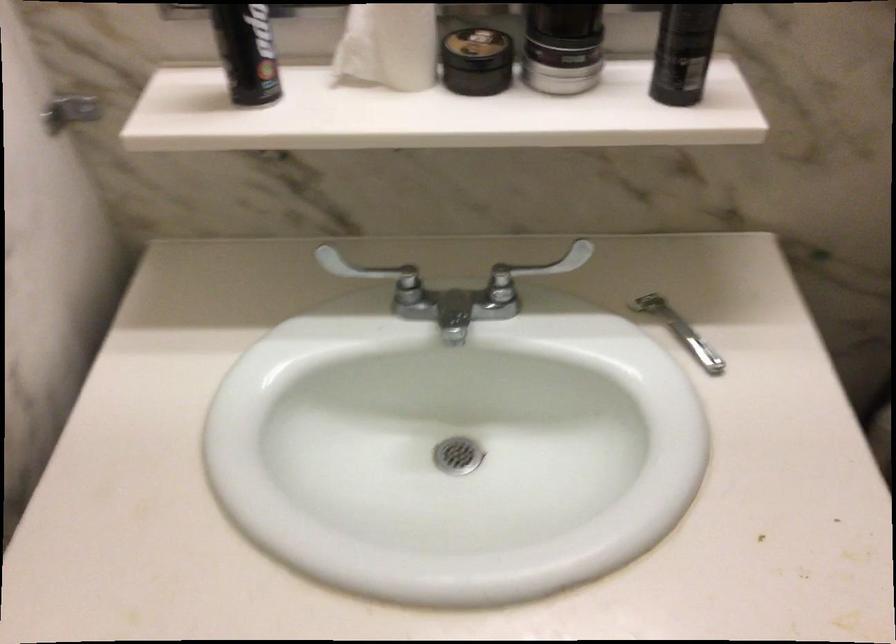
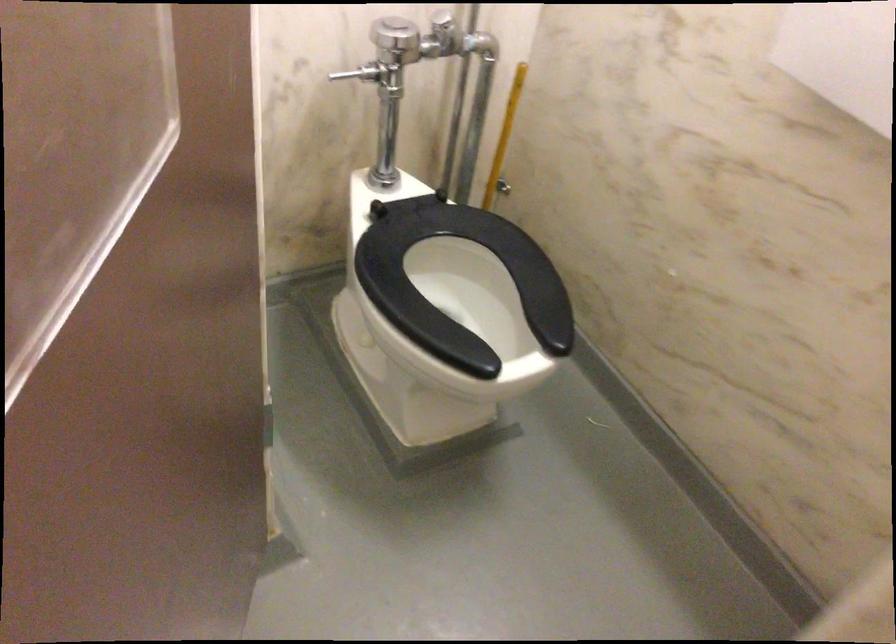
Question: The images are taken continuously from a first-person perspective. In which direction is your viewpoint rotating?

Choices:
 (A) Left
 (B) Right
 (C) Up
 (D) Down

Answer: (A)